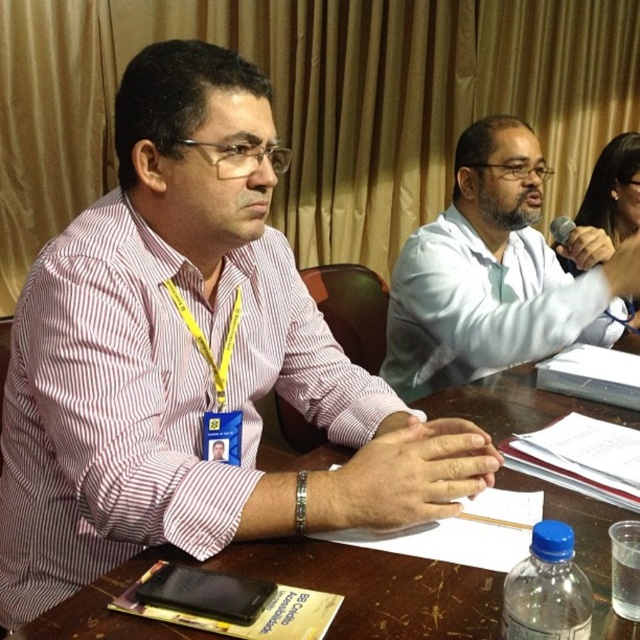
You are a conference attendee who needs to place a 20 cm wide document on the table between the pink striped shirt at left and the brown wooden table at center. Can you fit it there?

The distance between the pink striped shirt at left and the brown wooden table at center is 26.77 centimeters, which is more than enough to fit a 20 cm wide document.

You are attending a conference and need to place your name tag on the table. The name tag is the same size as the pink striped shirt at left. Can you place it on the brown wooden table at center without overlapping anything?

The pink striped shirt at left is positioned over brown wooden table at center, so placing the name tag of the same size would overlap the shirt, making it unsuitable for placement on the table.